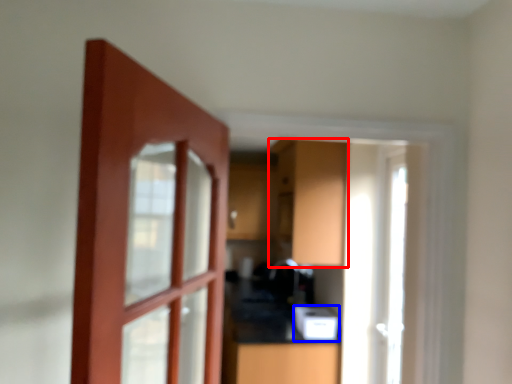
Question: Among these objects, which one is nearest to the camera, cabinetry (highlighted by a red box) or appliance (highlighted by a blue box)?

Choices:
 (A) cabinetry
 (B) appliance

Answer: (A)